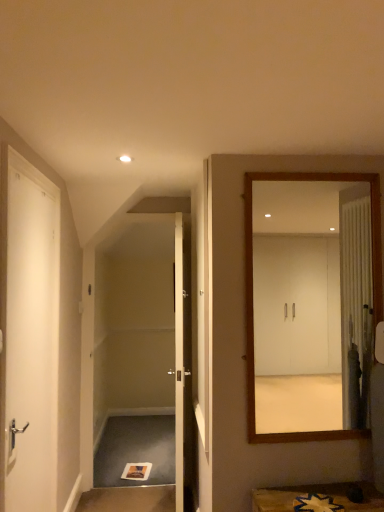
Question: Is white glossy door at center, the first door positioned from the back, directly adjacent to wooden mirror at right?

Choices:
 (A) yes
 (B) no

Answer: (B)

Question: Is white glossy door at center, which is the second door from left to right, facing towards wooden mirror at right?

Choices:
 (A) yes
 (B) no

Answer: (B)

Question: Is white glossy door at center, which appears as the 1th door when viewed from the right, positioned in front of wooden mirror at right?

Choices:
 (A) no
 (B) yes

Answer: (A)

Question: From the image's perspective, is white glossy door at center, which is the second door from left to right, located beneath wooden mirror at right?

Choices:
 (A) yes
 (B) no

Answer: (A)

Question: From the image's perspective, would you say white glossy door at center, which is the second door from left to right, is positioned over wooden mirror at right?

Choices:
 (A) no
 (B) yes

Answer: (A)

Question: Considering the positions of white glossy door at center, the 2th door viewed from the front, and wooden mirror at right in the image, is white glossy door at center, the 2th door viewed from the front, taller or shorter than wooden mirror at right?

Choices:
 (A) short
 (B) tall

Answer: (B)

Question: In the image, is white glossy door at center, the first door positioned from the back, positioned in front of or behind wooden mirror at right?

Choices:
 (A) behind
 (B) front

Answer: (A)

Question: Is white glossy door at center, which appears as the 1th door when viewed from the right, bigger or smaller than wooden mirror at right?

Choices:
 (A) big
 (B) small

Answer: (A)

Question: In terms of width, does white glossy door at center, the 2th door viewed from the front, look wider or thinner when compared to wooden mirror at right?

Choices:
 (A) wide
 (B) thin

Answer: (A)

Question: Is point (31, 431) closer or farther from the camera than point (286, 281)?

Choices:
 (A) farther
 (B) closer

Answer: (B)

Question: Is white matte door at left, marked as the 2th door in a right-to-left arrangement, taller or shorter than wooden mirror at right?

Choices:
 (A) short
 (B) tall

Answer: (B)

Question: From a real-world perspective, relative to wooden mirror at right, is white matte door at left, marked as the 2th door in a right-to-left arrangement, vertically above or below?

Choices:
 (A) below
 (B) above

Answer: (A)

Question: From the image's perspective, is white matte door at left, marked as the 2th door in a right-to-left arrangement, above or below wooden mirror at right?

Choices:
 (A) above
 (B) below

Answer: (B)

Question: Is white matte door at left, the 1th door positioned from the left, inside the boundaries of carpeted stair at lower left, or outside?

Choices:
 (A) outside
 (B) inside

Answer: (A)

Question: Is white matte door at left, the 1th door positioned from the left, bigger or smaller than carpeted stair at lower left?

Choices:
 (A) small
 (B) big

Answer: (B)